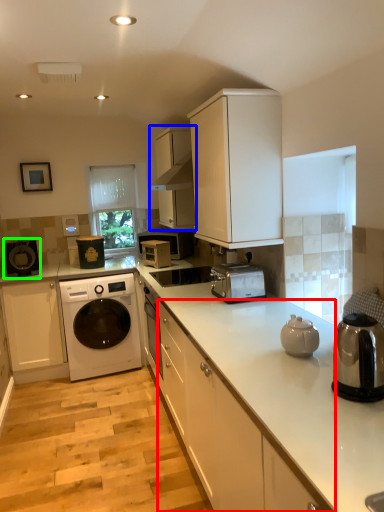
Question: Based on their relative distances, which object is nearer to cabinetry (highlighted by a red box)? Choose from cabinetry (highlighted by a blue box) and appliance (highlighted by a green box).

Choices:
 (A) cabinetry
 (B) appliance

Answer: (A)